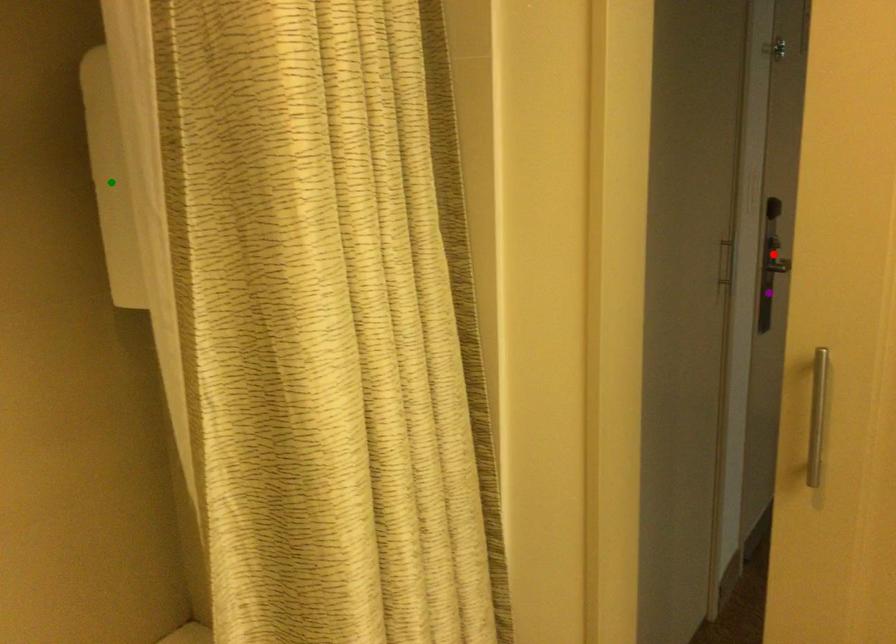
Order these from nearest to farthest:
green point | red point | purple point

red point, purple point, green point